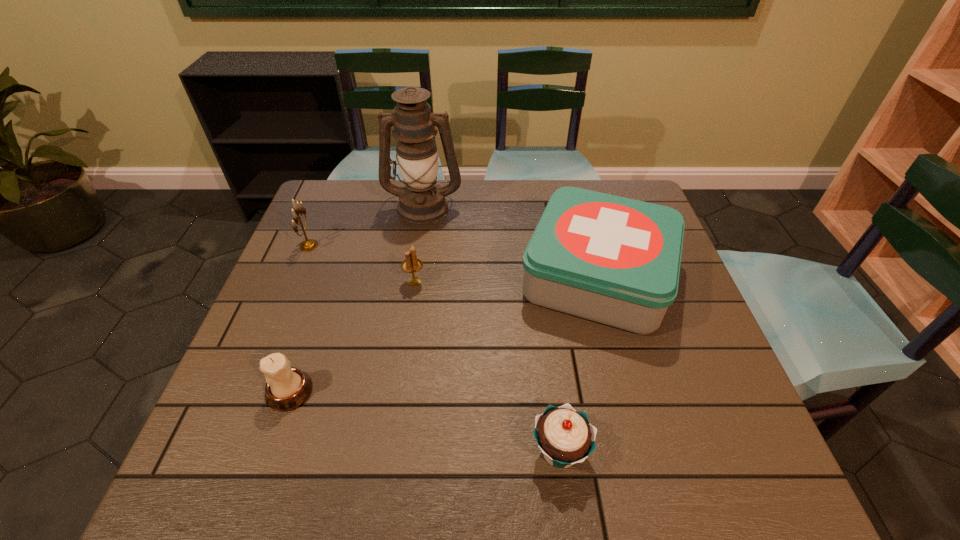
This screenshot has width=960, height=540. I want to click on free space located on the front of the leftmost object, so (266, 348).

At what (x,y) coordinates should I click in order to perform the action: click on vacant space located 0.170m on the back of the first-aid kit. Please return your answer as a coordinate pair (x, y). Looking at the image, I should click on (575, 194).

The width and height of the screenshot is (960, 540). I want to click on vacant area situated 0.320m on the right of the rightmost candle holder, so click(548, 282).

This screenshot has height=540, width=960. What are the coordinates of `vacant space situated 0.070m on the right of the nearest candle holder` in the screenshot? It's located at (346, 392).

Image resolution: width=960 pixels, height=540 pixels. Identify the location of vacant region located on the back of the cupcake. pos(549,372).

This screenshot has width=960, height=540. Find the location of `object at the far edge`. object at the far edge is located at coordinates point(421,201).

Where is `object present at the near edge`? object present at the near edge is located at coordinates (565, 436).

The height and width of the screenshot is (540, 960). In order to click on object situated at the right edge in this screenshot , I will do `click(613, 260)`.

Image resolution: width=960 pixels, height=540 pixels. I want to click on blank space at the far edge of the desktop, so click(x=485, y=191).

Identify the location of free space at the near edge of the desktop. The height and width of the screenshot is (540, 960). (578, 468).